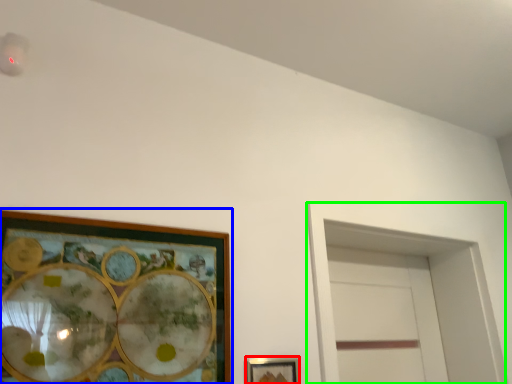
Question: Estimate the real-world distances between objects in this image. Which object is closer to picture frame (highlighted by a red box), picture frame (highlighted by a blue box) or glass door (highlighted by a green box)?

Choices:
 (A) picture frame
 (B) glass door

Answer: (A)